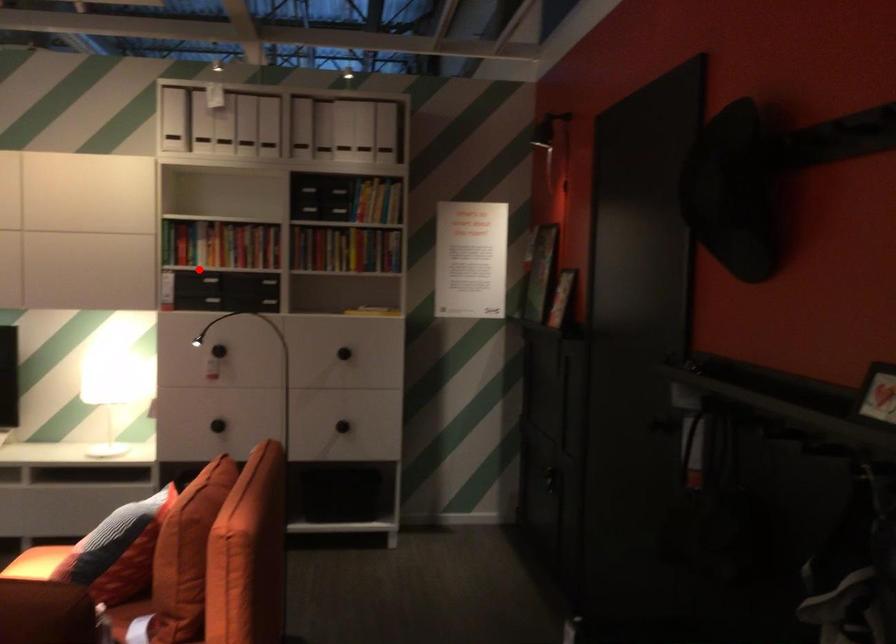
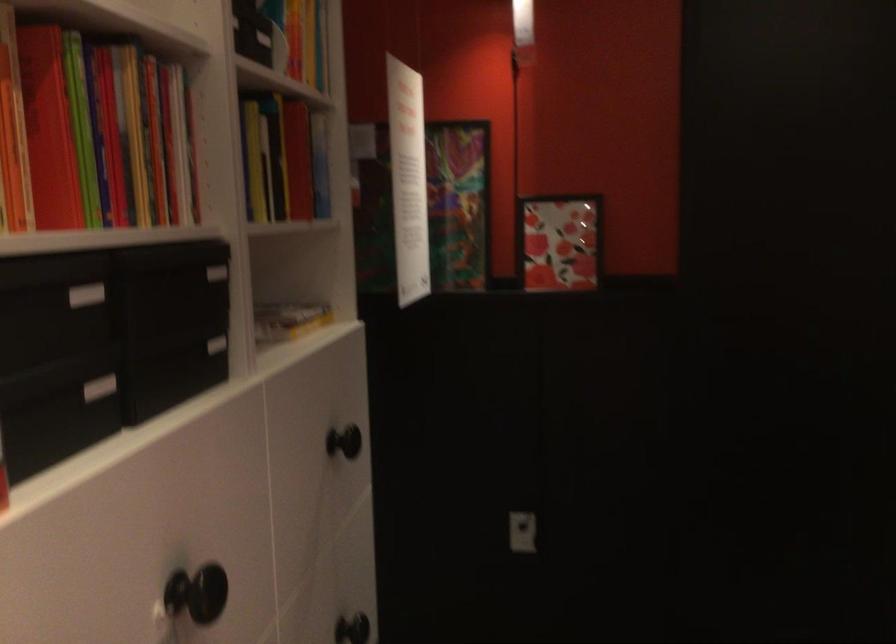
Find the pixel in the second image that matches the highlighted location in the first image.

(85, 295)